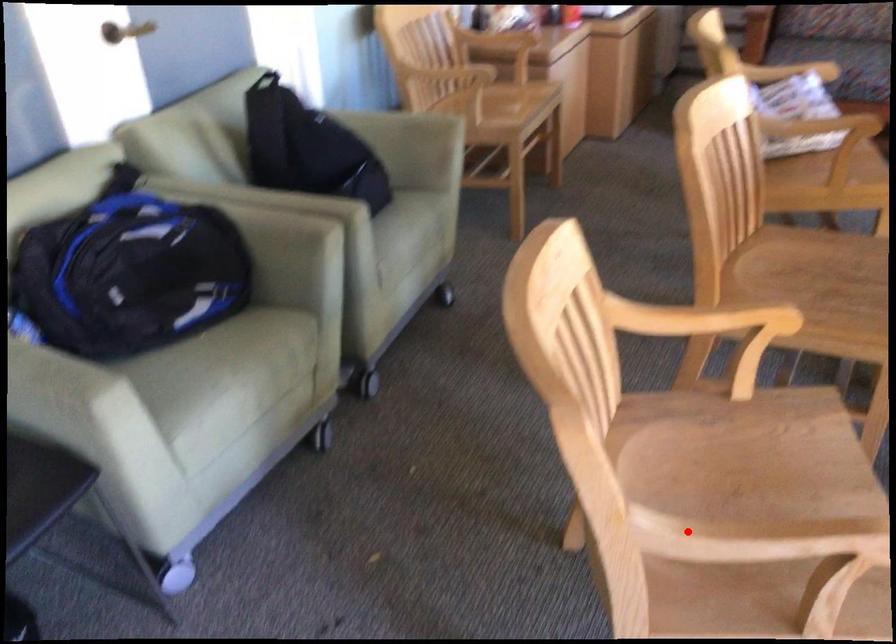
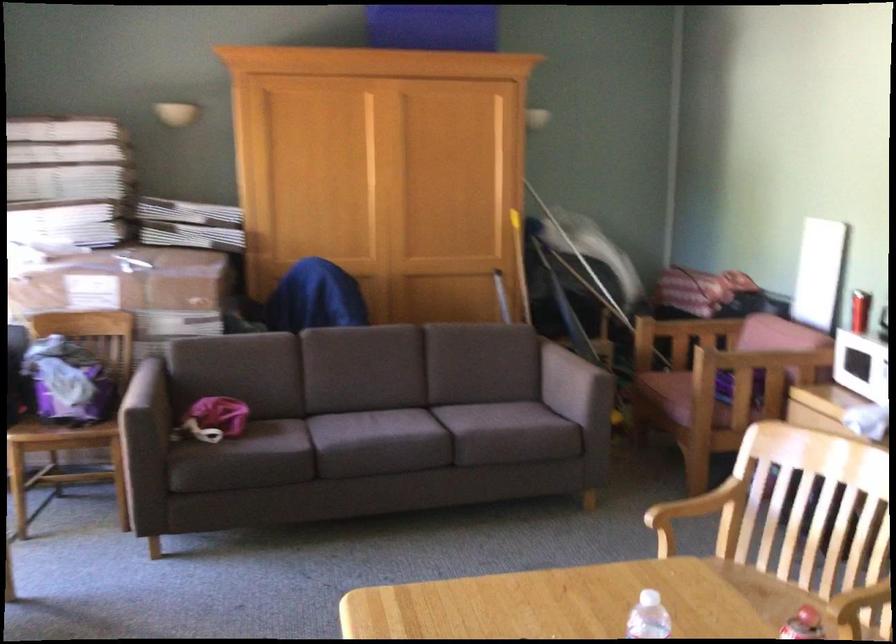
Question: I am providing you with two images of the same scene from different viewpoints. Image1 has a red point marked. In image2, the corresponding 3D location appears at what relative position? Reply with the corresponding letter.

Choices:
 (A) Closer
 (B) Farther

Answer: (B)